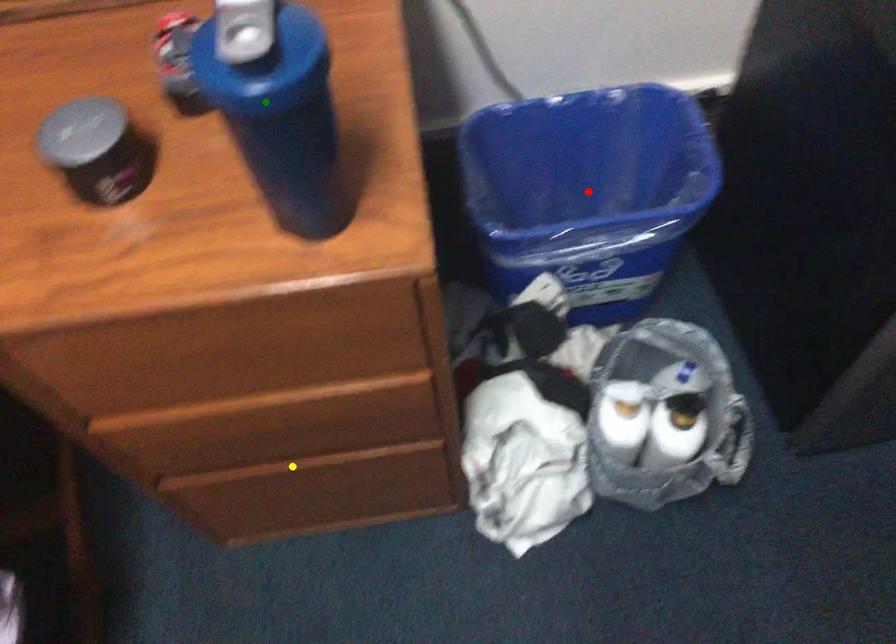
Order these from nearest to farthest:
- red point
- yellow point
- green point

1. green point
2. yellow point
3. red point